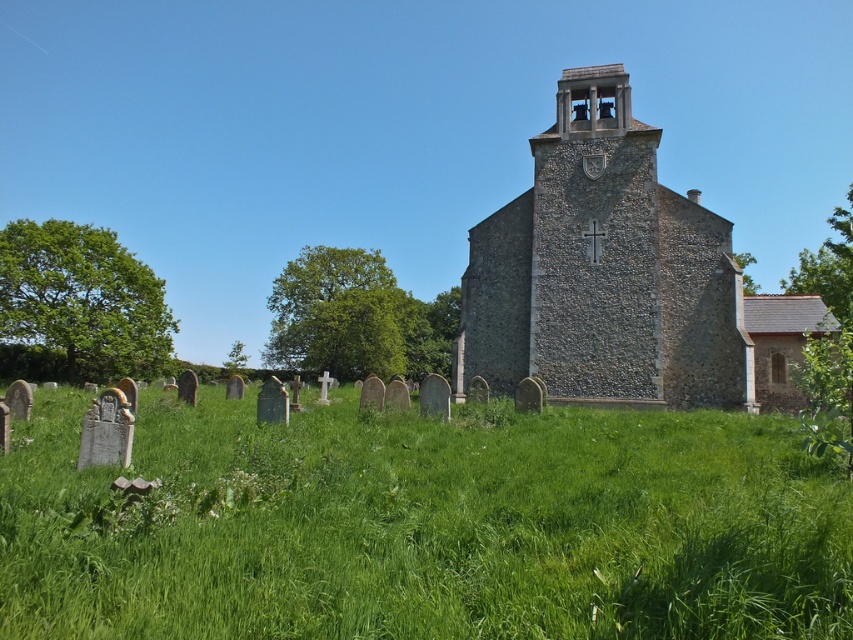
Can you confirm if green grassy field at lower center is positioned above stone church at center?

No, green grassy field at lower center is not above stone church at center.

Is point (798, 616) behind point (671, 317)?

No, it is in front of (671, 317).

Is point (39, 458) less distant than point (695, 378)?

Yes, point (39, 458) is in front of point (695, 378).

I want to click on green grassy field at lower center, so click(422, 525).